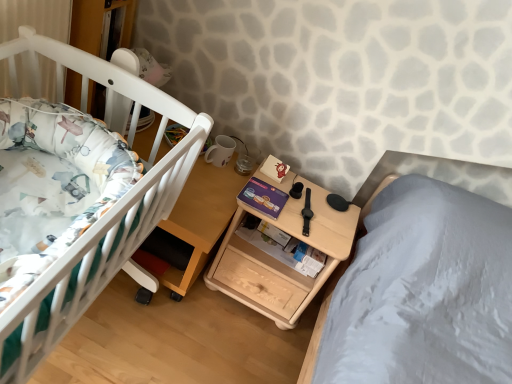
Question: Is wooden bookshelf at upper left in contact with natural wood nightstand at center?

Choices:
 (A) no
 (B) yes

Answer: (A)

Question: Is wooden bookshelf at upper left closer to the viewer compared to natural wood nightstand at center?

Choices:
 (A) yes
 (B) no

Answer: (B)

Question: Is wooden bookshelf at upper left thinner than natural wood nightstand at center?

Choices:
 (A) no
 (B) yes

Answer: (B)

Question: From a real-world perspective, is wooden bookshelf at upper left over natural wood nightstand at center?

Choices:
 (A) no
 (B) yes

Answer: (B)

Question: Could you tell me if wooden bookshelf at upper left is facing natural wood nightstand at center?

Choices:
 (A) no
 (B) yes

Answer: (B)

Question: In terms of height, does white matte crib at left look taller or shorter compared to natural wood nightstand at center?

Choices:
 (A) tall
 (B) short

Answer: (B)

Question: From a real-world perspective, is white matte crib at left above or below natural wood nightstand at center?

Choices:
 (A) below
 (B) above

Answer: (B)

Question: Looking at the image, does white matte crib at left seem bigger or smaller compared to natural wood nightstand at center?

Choices:
 (A) small
 (B) big

Answer: (A)

Question: Looking at their shapes, would you say white matte crib at left is wider or thinner than natural wood nightstand at center?

Choices:
 (A) thin
 (B) wide

Answer: (B)

Question: Is natural wood nightstand at center to the left or to the right of wooden table at left in the image?

Choices:
 (A) left
 (B) right

Answer: (B)

Question: From a real-world perspective, is natural wood nightstand at center physically located above or below wooden table at left?

Choices:
 (A) above
 (B) below

Answer: (A)

Question: Is point pyautogui.click(x=322, y=230) closer or farther from the camera than point pyautogui.click(x=184, y=225)?

Choices:
 (A) closer
 (B) farther

Answer: (B)

Question: In terms of width, does natural wood nightstand at center look wider or thinner when compared to wooden table at left?

Choices:
 (A) wide
 (B) thin

Answer: (B)

Question: Is point (105, 54) positioned closer to the camera than point (322, 284)?

Choices:
 (A) farther
 (B) closer

Answer: (B)

Question: Looking at the image, does wooden bookshelf at upper left seem bigger or smaller compared to natural wood nightstand at center?

Choices:
 (A) small
 (B) big

Answer: (A)